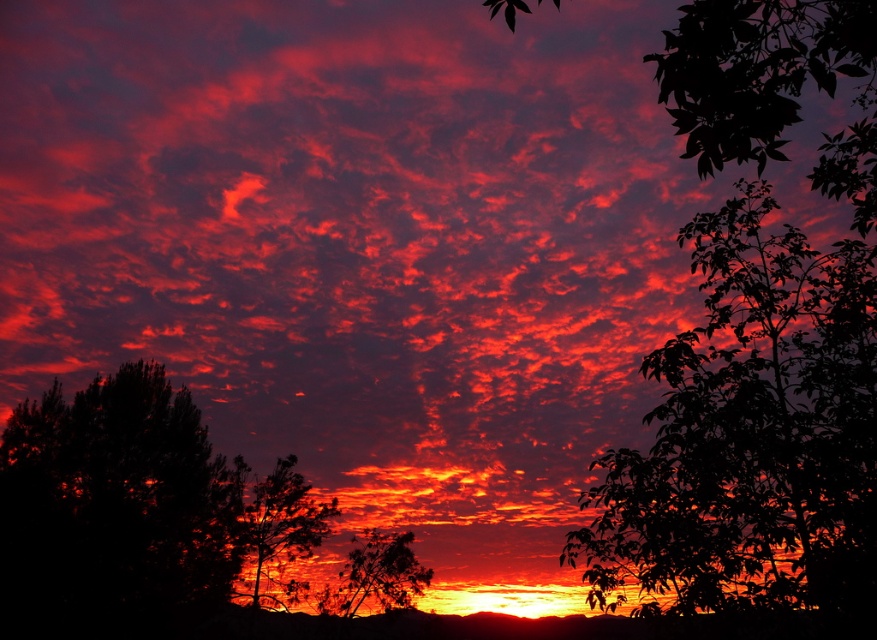
Does point (243, 497) come in front of point (380, 586)?

No, it is not.

Does silky dark green tree at lower left have a lesser height compared to silhouette leafy tree at center?

No, silky dark green tree at lower left is not shorter than silhouette leafy tree at center.

Is point (240, 577) positioned before point (374, 586)?

No, it is behind (374, 586).

Where is `silky dark green tree at lower left`? This screenshot has width=877, height=640. silky dark green tree at lower left is located at coordinates (280, 532).

Does point (866, 464) lie in front of point (151, 588)?

Yes.

Is point (763, 285) more distant than point (282, 636)?

No.

What do you see at coordinates (752, 433) in the screenshot?
I see `silhouette leafy tree at right` at bounding box center [752, 433].

This screenshot has height=640, width=877. I want to click on silhouette leafy tree at right, so click(x=752, y=433).

Which is more to the left, silhouette leafy tree at right or silhouette leafy tree at center?

From the viewer's perspective, silhouette leafy tree at center appears more on the left side.

Which is more to the right, silhouette leafy tree at right or silhouette leafy tree at center?

silhouette leafy tree at right

Is point (610, 550) farther from camera compared to point (322, 588)?

That is False.

At what (x,y) coordinates should I click in order to perform the action: click on silhouette leafy tree at right. Please return your answer as a coordinate pair (x, y). This screenshot has width=877, height=640. Looking at the image, I should click on (752, 433).